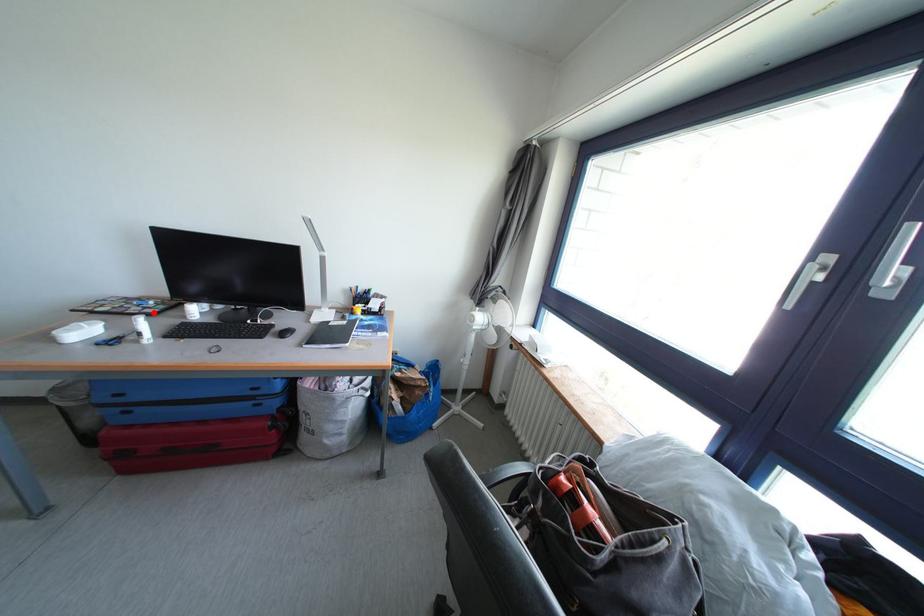
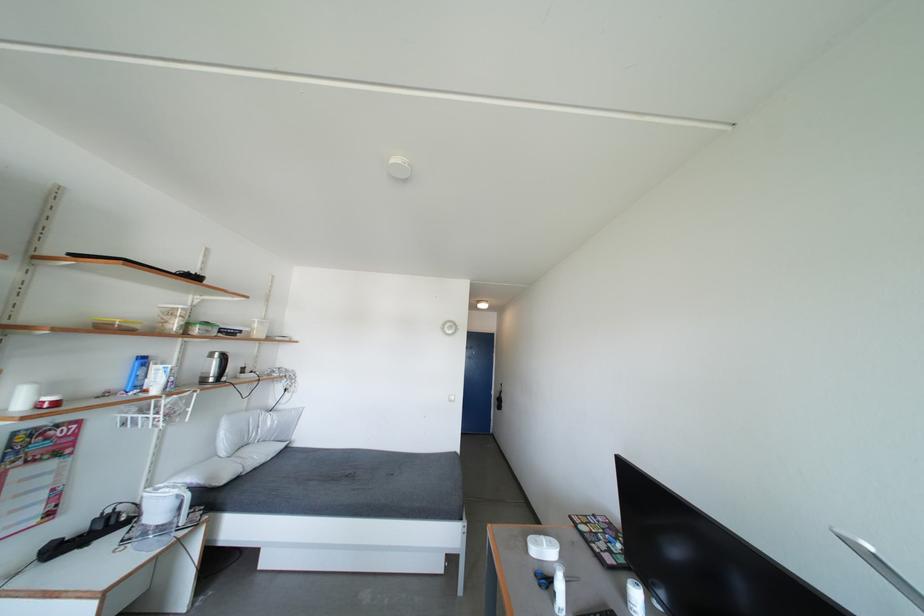
In the second image, find the point that corresponds to the highlighted location in the first image.

(616, 556)